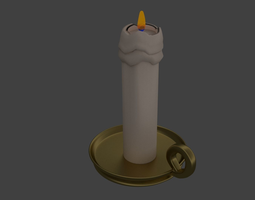
At what (x,y) coordinates should I click in order to perform the action: click on empty space right of candle. Please return your answer as a coordinate pair (x, y). Image resolution: width=255 pixels, height=200 pixels. Looking at the image, I should click on (234, 88).